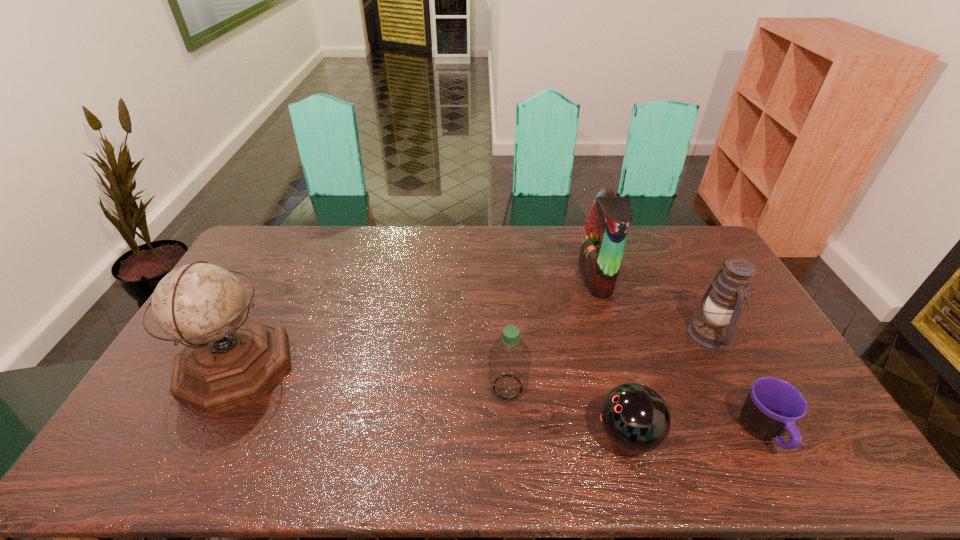
I want to click on free space located at the face of the parrot, so click(562, 277).

What are the coordinates of `vacant position located 0.320m on the back of the oil lamp` in the screenshot? It's located at (668, 254).

What are the coordinates of `vacant space located 0.090m on the right of the water bottle` in the screenshot? It's located at (560, 387).

Image resolution: width=960 pixels, height=540 pixels. I want to click on vacant space located on the surface of the bowling ball near the finger holes, so click(x=467, y=435).

Identify the location of vacant region located on the surface of the bowling ball near the finger holes. (467, 435).

Find the location of a particular element. This screenshot has width=960, height=540. vacant space situated on the surface of the bowling ball near the finger holes is located at coordinates (561, 435).

Where is `object that is at the far edge`? object that is at the far edge is located at coordinates (601, 252).

Identify the location of bowling ball that is at the near edge. The height and width of the screenshot is (540, 960). (635, 418).

Locate an element on the screen. The height and width of the screenshot is (540, 960). mug that is at the near edge is located at coordinates (773, 406).

The width and height of the screenshot is (960, 540). I want to click on object positioned at the left edge, so click(x=229, y=361).